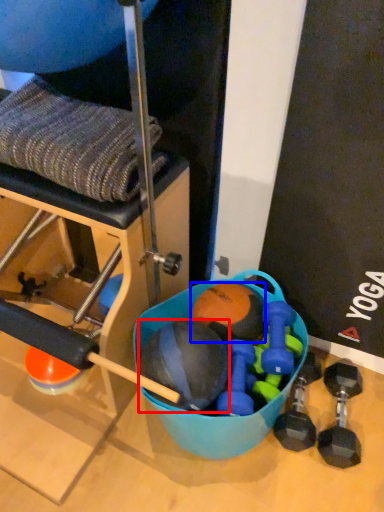
Question: Which object is further to the camera taking this photo, ball (highlighted by a red box) or ball (highlighted by a blue box)?

Choices:
 (A) ball
 (B) ball

Answer: (B)